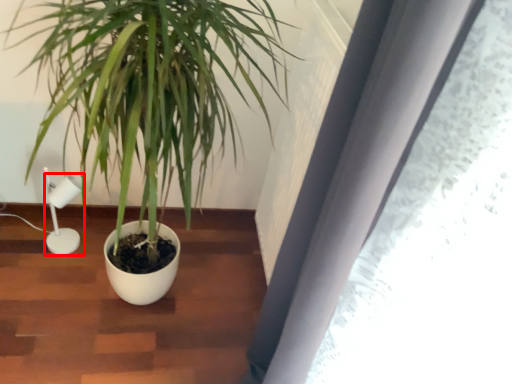
Question: From the image's perspective, where is lamp (annotated by the red box) located relative to houseplant?

Choices:
 (A) below
 (B) above

Answer: (A)